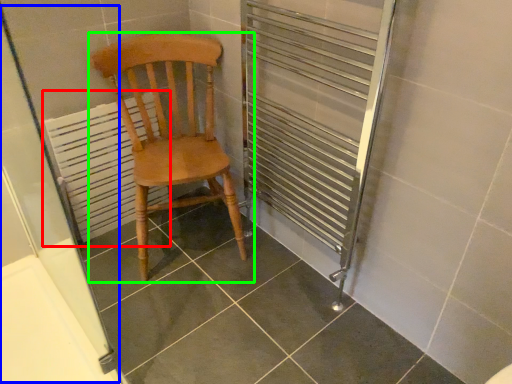
Question: Which is farther away from radiator (highlighted by a red box)? screen door (highlighted by a blue box) or chair (highlighted by a green box)?

Choices:
 (A) screen door
 (B) chair

Answer: (B)